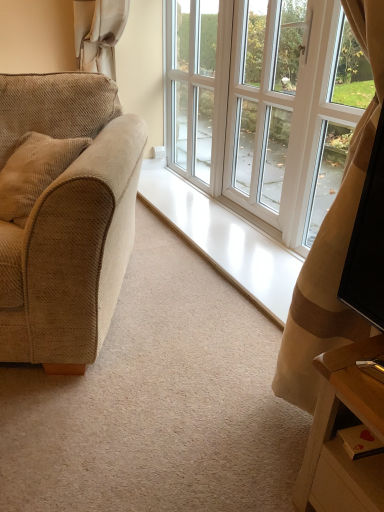
Image resolution: width=384 pixels, height=512 pixels. I want to click on free space between white glass window at center and beige corduroy couch at left, so click(x=174, y=360).